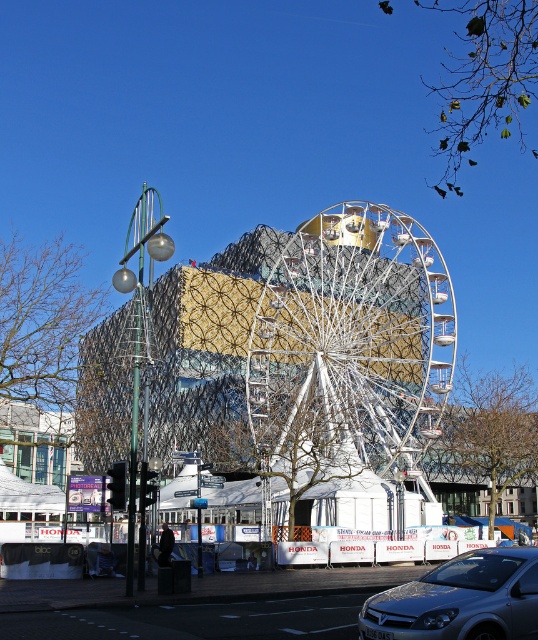
Is silver metallic car at lower right above white metallic wheel at center?

Yes, silver metallic car at lower right is above white metallic wheel at center.

Who is more forward, (486,596) or (485,621)?

Point (485,621) is more forward.

The width and height of the screenshot is (538, 640). Identify the location of silver metallic car at lower right. (459, 598).

Find the location of a particular element. silver metallic car at lower right is located at coordinates (459, 598).

Which is more to the right, white metallic ferris wheel at center or silver metallic car at lower right?

Positioned to the right is white metallic ferris wheel at center.

Who is more distant from viewer, [398,305] or [421,612]?

Positioned behind is point [398,305].

Does point (379, 248) come farther from viewer compared to point (520, 588)?

That is True.

Where is `white metallic ferris wheel at center`? The width and height of the screenshot is (538, 640). white metallic ferris wheel at center is located at coordinates (350, 346).

The height and width of the screenshot is (640, 538). What do you see at coordinates (350, 346) in the screenshot? I see `white metallic ferris wheel at center` at bounding box center [350, 346].

Is the position of white metallic ferris wheel at center more distant than that of white metallic wheel at center?

Yes, white metallic ferris wheel at center is further from the viewer.

Image resolution: width=538 pixels, height=640 pixels. Identify the location of white metallic ferris wheel at center. (350, 346).

Locate an element on the screen. Image resolution: width=538 pixels, height=640 pixels. white metallic ferris wheel at center is located at coordinates (350, 346).